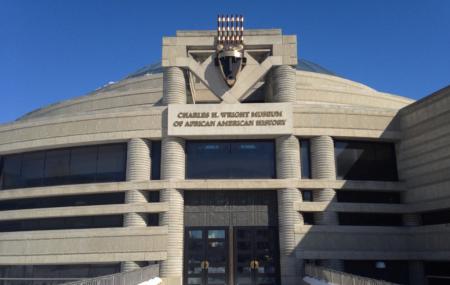
You are a GUI agent. You are given a task and a screenshot of the screen. Output one action in this format:
    pyautogui.click(x=<x>, y=<y>)
    Task: Click on the door handles
    This screenshot has height=285, width=450.
    Given the screenshot: What is the action you would take?
    pyautogui.click(x=254, y=264), pyautogui.click(x=205, y=265)